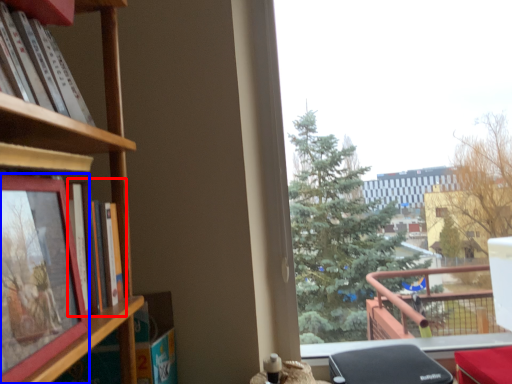
Question: Which of the following is the farthest to the observer, book (highlighted by a red box) or picture frame (highlighted by a blue box)?

Choices:
 (A) book
 (B) picture frame

Answer: (A)